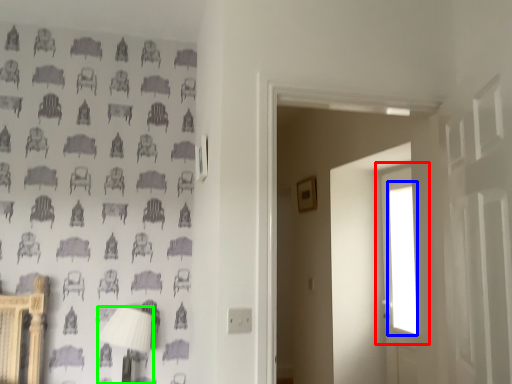
Question: Which object is the closest to the window (highlighted by a red box)? Choose among these: window (highlighted by a blue box) or table lamp (highlighted by a green box).

Choices:
 (A) window
 (B) table lamp

Answer: (A)